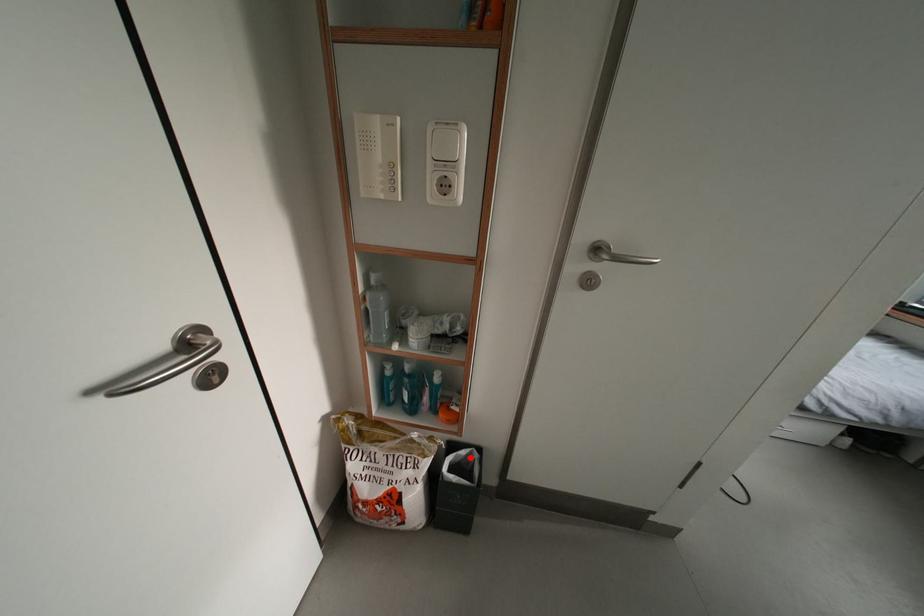
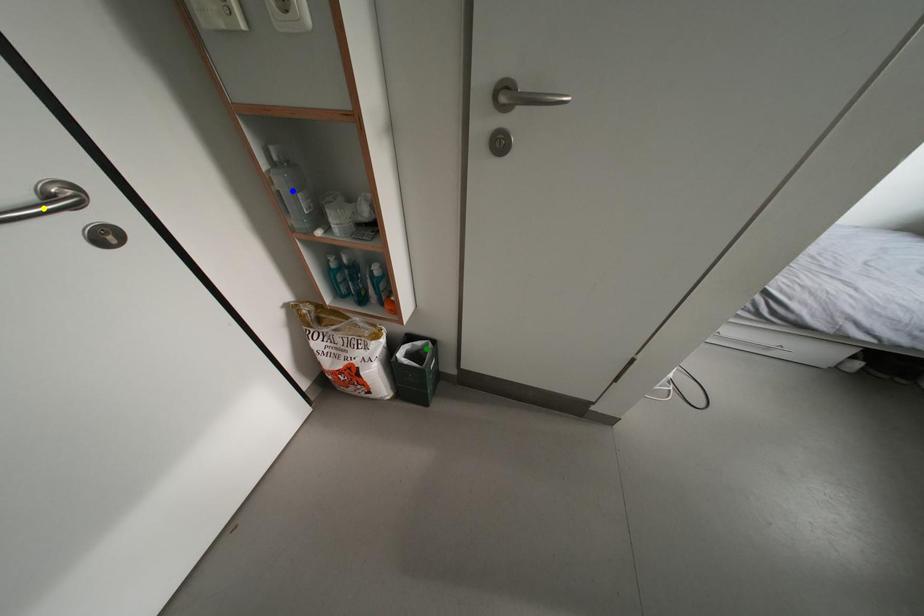
Question: I am providing you with two images of the same scene from different viewpoints. A red point is marked on the first image. You are given multiple points on the second image. Which spot in image 2 lines up with the point in image 1?

Choices:
 (A) green point
 (B) blue point
 (C) yellow point

Answer: (A)